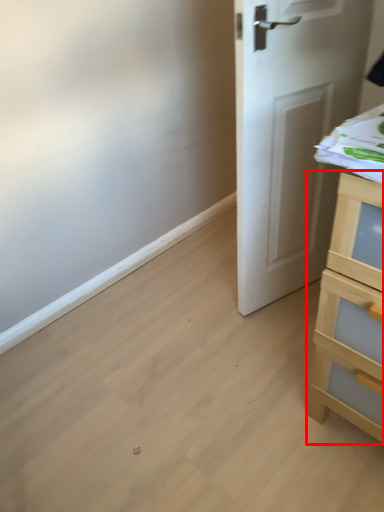
Question: Where is chest of drawers (annotated by the red box) located in relation to door in the image?

Choices:
 (A) left
 (B) right

Answer: (B)